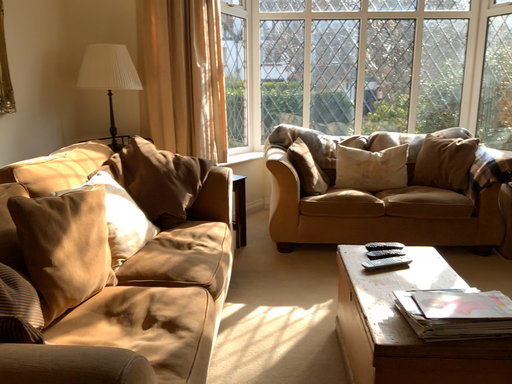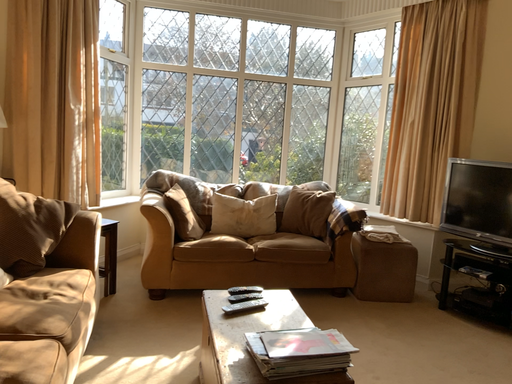
Question: Which way did the camera rotate in the video?

Choices:
 (A) rotated left
 (B) rotated right

Answer: (B)